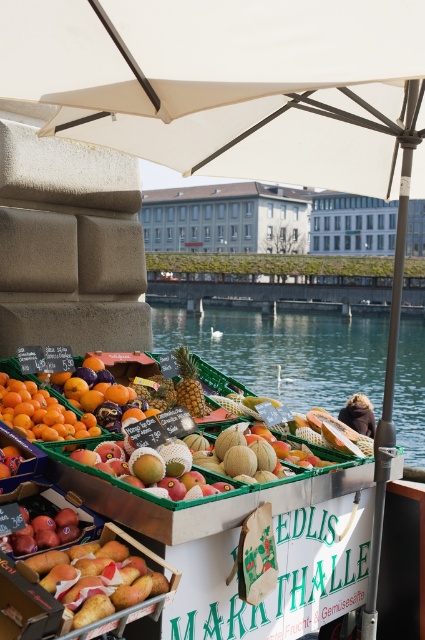
Can you confirm if transparent water at center is wider than orange matte/orange melon at lower left?

Correct, the width of transparent water at center exceeds that of orange matte/orange melon at lower left.

Can you confirm if transparent water at center is thinner than orange matte/orange melon at lower left?

In fact, transparent water at center might be wider than orange matte/orange melon at lower left.

The height and width of the screenshot is (640, 425). What do you see at coordinates (283, 352) in the screenshot? I see `transparent water at center` at bounding box center [283, 352].

The image size is (425, 640). What are the coordinates of `transparent water at center` in the screenshot? It's located at (283, 352).

Based on the photo, who is higher up, yellow matte pineapple at center or smooth brown vendor at center?

Positioned higher is yellow matte pineapple at center.

Is yellow matte pineapple at center positioned behind smooth brown vendor at center?

No, yellow matte pineapple at center is closer to the viewer.

Who is more distant from viewer, (184,349) or (356,428)?

Point (356,428)

You are a GUI agent. You are given a task and a screenshot of the screen. Output one action in this format:
    pyautogui.click(x=<x>, y=<y>)
    Task: Click on the yellow matte pineapple at center
    
    Given the screenshot: What is the action you would take?
    pyautogui.click(x=189, y=384)

Is transparent water at center wider than yellow matte pineapple at center?

Yes, transparent water at center is wider than yellow matte pineapple at center.

Can you confirm if transparent water at center is positioned above yellow matte pineapple at center?

No.

The height and width of the screenshot is (640, 425). Describe the element at coordinates (283, 352) in the screenshot. I see `transparent water at center` at that location.

Where is `transparent water at center`? Image resolution: width=425 pixels, height=640 pixels. transparent water at center is located at coordinates (283, 352).